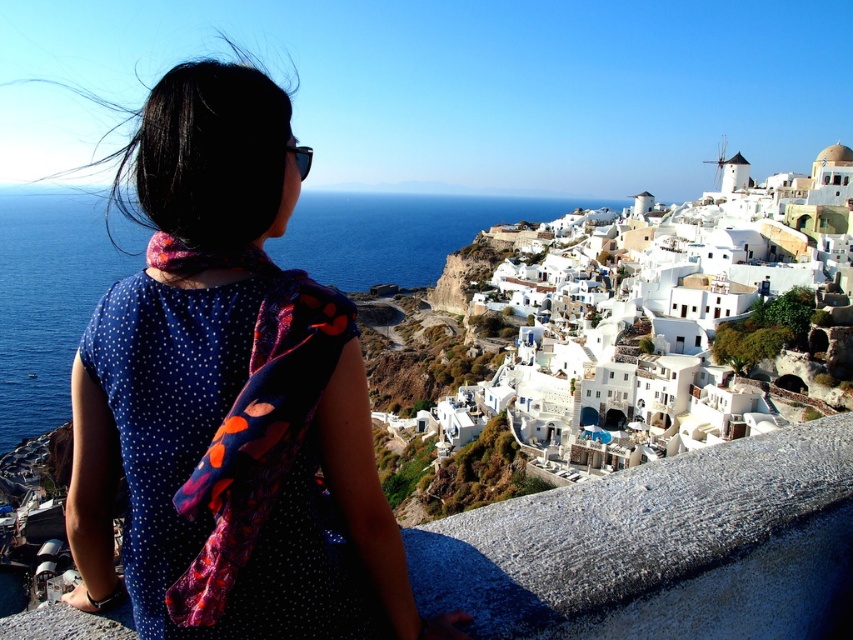
Question: Which point is closer to the camera?

Choices:
 (A) blue dotted dress at center
 (B) blue dotted fabric dress at upper left
 (C) blue water at center

Answer: (B)

Question: Which point is closer to the camera?

Choices:
 (A) blue dotted fabric dress at upper left
 (B) blue dotted dress at center

Answer: (A)

Question: Can you confirm if white stucco buildings at upper right is wider than blue dotted fabric dress at upper left?

Choices:
 (A) no
 (B) yes

Answer: (B)

Question: Can you confirm if blue dotted dress at center is positioned above blue water at center?

Choices:
 (A) yes
 (B) no

Answer: (B)

Question: Which point is farther to the camera?

Choices:
 (A) white stucco buildings at upper right
 (B) blue dotted dress at center
 (C) blue dotted fabric dress at upper left
 (D) blue water at center

Answer: (D)

Question: Is blue dotted dress at center in front of blue water at center?

Choices:
 (A) no
 (B) yes

Answer: (B)